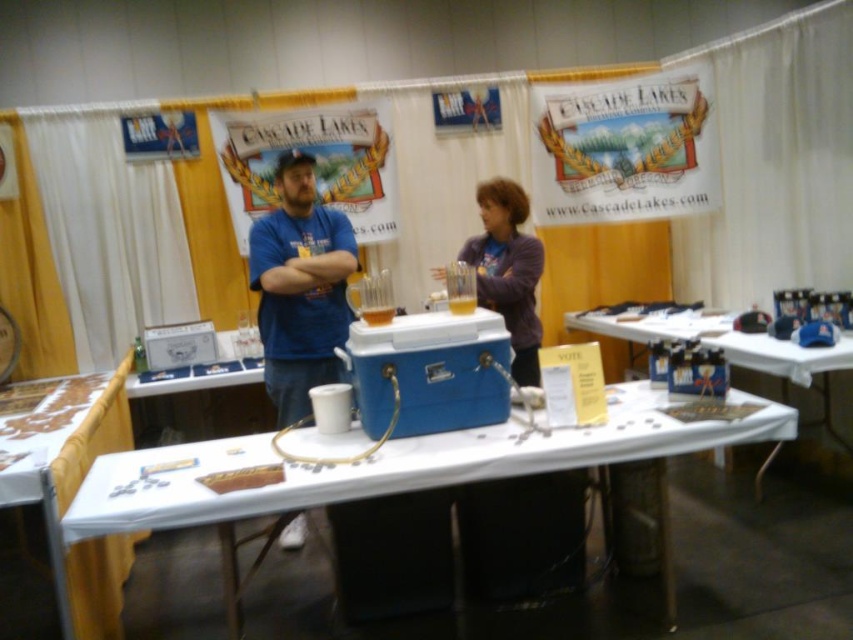
Between blue plastic cooler at center and matte blue cooler at center, which one has more height?

With more height is blue plastic cooler at center.

Measure the distance between point (630, 460) and camera.

Point (630, 460) is 2.15 meters away from camera.

I want to click on blue plastic cooler at center, so click(x=387, y=467).

Is blue plastic cooler at center below blue t-shirt at center?

Yes.

Is point (444, 440) positioned after point (291, 384)?

No, (444, 440) is in front of (291, 384).

Between point (363, 477) and point (345, 243), which one is positioned in front?

Point (363, 477) is more forward.

Locate an element on the screen. The image size is (853, 640). blue plastic cooler at center is located at coordinates (387, 467).

Is blue plastic cooler at center smaller than purple fleece jacket at center?

No.

Consider the image. Is blue plastic cooler at center to the right of purple fleece jacket at center from the viewer's perspective?

No, blue plastic cooler at center is not to the right of purple fleece jacket at center.

Between point (218, 452) and point (491, 230), which one is positioned in front?

Point (218, 452) is more forward.

Image resolution: width=853 pixels, height=640 pixels. I want to click on blue plastic cooler at center, so click(x=387, y=467).